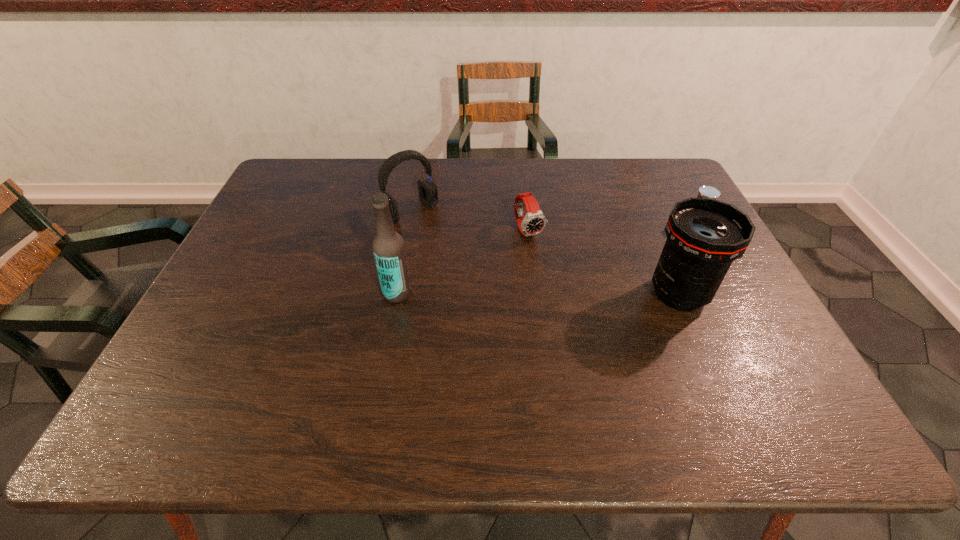
The height and width of the screenshot is (540, 960). I want to click on jam present at the right edge, so pyautogui.click(x=705, y=191).

Identify the location of free space at the far edge of the desktop. coord(502,178).

Where is `free space at the left edge of the desktop`? This screenshot has height=540, width=960. free space at the left edge of the desktop is located at coordinates (239, 274).

In the image, there is a desktop. Where is `free region at the far left corner`? free region at the far left corner is located at coordinates (279, 197).

What are the coordinates of `vacant space at the near left corner of the desktop` in the screenshot? It's located at (220, 380).

The height and width of the screenshot is (540, 960). Find the location of `vacant space at the far right corner of the desktop`. vacant space at the far right corner of the desktop is located at coordinates (670, 163).

You are a GUI agent. You are given a task and a screenshot of the screen. Output one action in this format:
    pyautogui.click(x=<x>, y=<y>)
    Task: Click on the vacant space that is in between the rightmost object and the tallest object
    
    Given the screenshot: What is the action you would take?
    pyautogui.click(x=546, y=259)

The width and height of the screenshot is (960, 540). What are the coordinates of `blank region between the headset and the jam` in the screenshot? It's located at (553, 218).

Identify the location of free spot between the third object from right to left and the tallest object. This screenshot has height=540, width=960. (463, 262).

I want to click on blank region between the rightmost object and the tallest object, so pos(546,259).